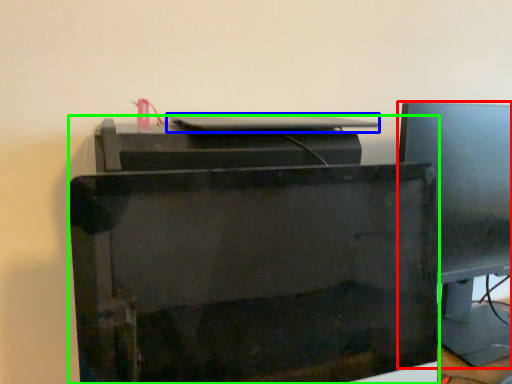
Question: Based on their relative distances, which object is farther from computer monitor (highlighted by a red box)? Choose from desktop (highlighted by a blue box) and printer (highlighted by a green box).

Choices:
 (A) desktop
 (B) printer

Answer: (B)